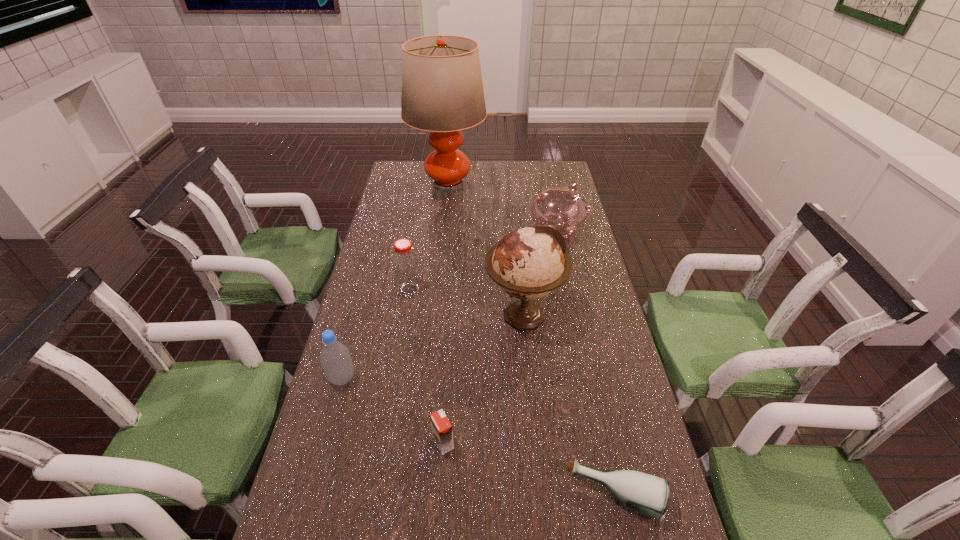
Image resolution: width=960 pixels, height=540 pixels. I want to click on vacant space that satisfies the following two spatial constraints: 1. on the front of the second tallest object showing Asia; 2. on the back side of the nearest object, so click(541, 496).

At what (x,y) coordinates should I click in order to perform the action: click on blank area in the image that satisfies the following two spatial constraints: 1. on the back side of the shortest bottle; 2. on the front facing side of the piggy bank. Please return your answer as a coordinate pair (x, y). Looking at the image, I should click on (558, 232).